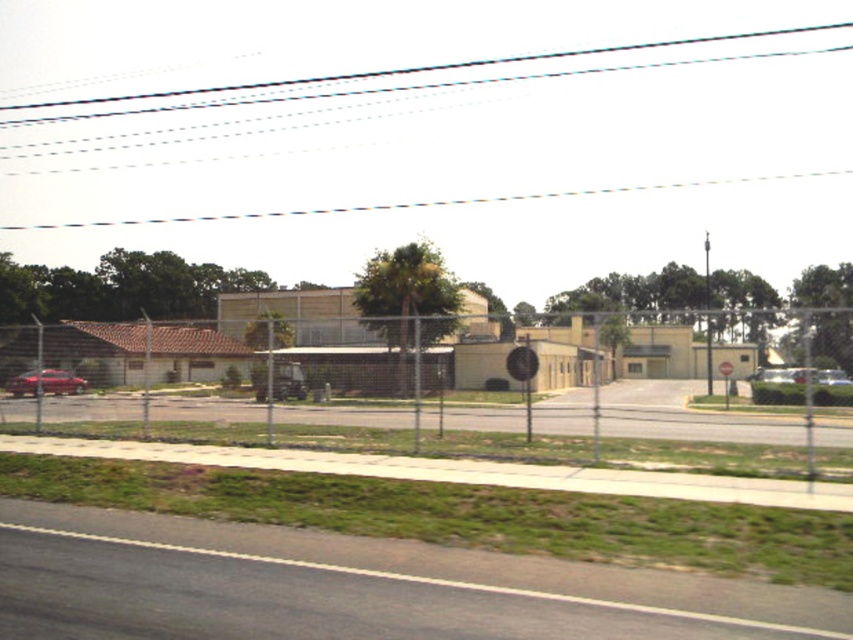
Question: Is metallic chain-link fence at center further to camera compared to clear plastic power line at upper center?

Choices:
 (A) no
 (B) yes

Answer: (A)

Question: Based on their relative distances, which object is farther from the shiny red sedan at left?

Choices:
 (A) metallic chain-link fence at center
 (B) clear plastic power line at upper center

Answer: (B)

Question: Which of the following is the closest to the observer?

Choices:
 (A) shiny red sedan at left
 (B) clear plastic power line at upper center
 (C) metallic chain-link fence at center

Answer: (C)

Question: Estimate the real-world distances between objects in this image. Which object is farther from the shiny red sedan at left?

Choices:
 (A) metallic chain-link fence at center
 (B) clear plastic power line at upper center

Answer: (B)

Question: In this image, where is clear plastic power line at upper center located relative to shiny red sedan at left?

Choices:
 (A) left
 (B) right

Answer: (B)

Question: Is clear plastic power line at upper center positioned behind shiny red sedan at left?

Choices:
 (A) no
 (B) yes

Answer: (B)